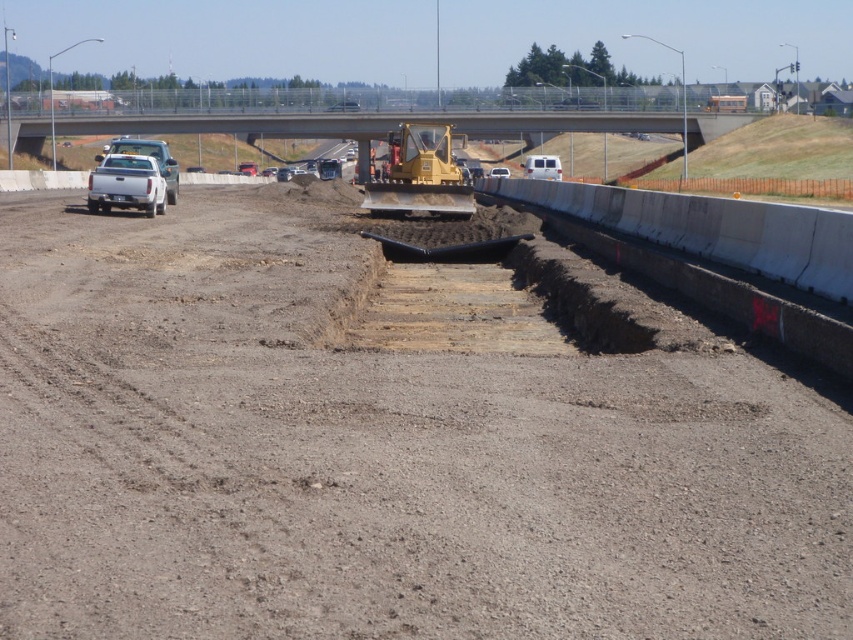
Between yellow metallic excavator at center and white matte truck at left, which one is positioned lower?

white matte truck at left

Locate an element on the screen. yellow metallic excavator at center is located at coordinates (419, 176).

Between white matte truck at left and white matte van at center, which one appears on the right side from the viewer's perspective?

white matte van at center is more to the right.

Does white matte truck at left have a lesser height compared to white matte van at center?

Yes.

Which is in front, point (152, 179) or point (525, 163)?

Point (152, 179) is more forward.

Image resolution: width=853 pixels, height=640 pixels. What are the coordinates of `white matte truck at left` in the screenshot? It's located at (126, 184).

Who is positioned more to the left, brown dirt field at center or white matte truck at left?

Positioned to the left is white matte truck at left.

Can you confirm if brown dirt field at center is positioned above white matte truck at left?

Incorrect, brown dirt field at center is not positioned above white matte truck at left.

This screenshot has height=640, width=853. What do you see at coordinates (375, 456) in the screenshot?
I see `brown dirt field at center` at bounding box center [375, 456].

Where is `brown dirt field at center`? Image resolution: width=853 pixels, height=640 pixels. brown dirt field at center is located at coordinates (375, 456).